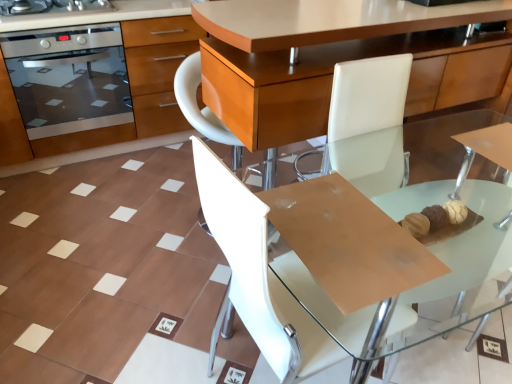
This screenshot has height=384, width=512. What do you see at coordinates (468, 247) in the screenshot?
I see `transparent glass table at center` at bounding box center [468, 247].

You are a GUI agent. You are given a task and a screenshot of the screen. Output one action in this format:
    pyautogui.click(x=<x>, y=<y>)
    Task: Click on the stainless steel oven at left
    This screenshot has width=512, height=384.
    Given the screenshot: What is the action you would take?
    pyautogui.click(x=68, y=78)

Locate an element on the screen. The height and width of the screenshot is (384, 512). stainless steel oven at left is located at coordinates (130, 86).

Based on the photo, in order to face white leather chair at center, should I rotate leftwards or rightwards?

Rotate right and turn 6.755 degrees.

I want to click on transparent glass table at center, so click(x=468, y=247).

Is stainless steel oven at left facing towards white leather chair at center?

Yes.

Would you say white leather chair at center is part of stainless steel oven at left's contents?

Actually, white leather chair at center is outside stainless steel oven at left.

Would you say stainless steel oven at left is to the left or to the right of white leather chair at center in the picture?

In the image, stainless steel oven at left appears on the left side of white leather chair at center.

Who is bigger, stainless steel oven at left or white leather chair at center?

With larger size is stainless steel oven at left.

Which of these two, transparent glass table at center or stainless steel oven at left, is smaller?

stainless steel oven at left is smaller.

Which point is more forward, (467, 251) or (99, 93)?

The point (467, 251) is closer to the camera.

From a real-world perspective, is transparent glass table at center physically below stainless steel oven at left?

Yes, from a real-world perspective, transparent glass table at center is beneath stainless steel oven at left.

Considering the positions of objects transparent glass table at center and stainless steel oven at left in the image provided, who is behind, transparent glass table at center or stainless steel oven at left?

stainless steel oven at left is further away from the camera.

From their relative heights in the image, would you say white leather chair at center is taller or shorter than stainless steel oven at upper left?

Considering their sizes, white leather chair at center has more height than stainless steel oven at upper left.

Between white leather chair at center and stainless steel oven at upper left, which one has smaller size?

stainless steel oven at upper left is smaller.

Considering the positions of objects white leather chair at center and stainless steel oven at upper left in the image provided, who is more to the right, white leather chair at center or stainless steel oven at upper left?

From the viewer's perspective, white leather chair at center appears more on the right side.

From the image's perspective, is white leather chair at center below stainless steel oven at upper left?

Yes, from the image's perspective, white leather chair at center is beneath stainless steel oven at upper left.

Considering their positions, is stainless steel oven at left located in front of or behind stainless steel oven at left?

Clearly, stainless steel oven at left is in front of stainless steel oven at left.

Is stainless steel oven at left bigger or smaller than stainless steel oven at left?

stainless steel oven at left is bigger than stainless steel oven at left.

Are stainless steel oven at left and stainless steel oven at left beside each other?

stainless steel oven at left and stainless steel oven at left are not in contact.

Does stainless steel oven at left have a lesser height compared to stainless steel oven at left?

No.

Does white leather chair at center have a larger size compared to stainless steel oven at left?

Actually, white leather chair at center might be smaller than stainless steel oven at left.

Based on the photo, which is farther from the camera, (223, 212) or (50, 141)?

Positioned behind is point (50, 141).

Between white leather chair at center and stainless steel oven at left, which one appears on the right side from the viewer's perspective?

Positioned to the right is white leather chair at center.

Is white leather chair at center positioned with its back to stainless steel oven at left?

white leather chair at center is not turned away from stainless steel oven at left.

Would you consider stainless steel oven at upper left to be distant from stainless steel oven at left?

No.

From a real-world perspective, is stainless steel oven at upper left above or below stainless steel oven at left?

stainless steel oven at upper left is above stainless steel oven at left.

Which object is further away from the camera, stainless steel oven at upper left or stainless steel oven at left?

stainless steel oven at left is more distant.

Is stainless steel oven at upper left inside the boundaries of stainless steel oven at left, or outside?

stainless steel oven at upper left cannot be found inside stainless steel oven at left.

Which of these two, transparent glass table at center or stainless steel oven at left, is smaller?

Smaller between the two is transparent glass table at center.

Would you say transparent glass table at center is inside or outside stainless steel oven at left?

transparent glass table at center cannot be found inside stainless steel oven at left.

Is transparent glass table at center beside stainless steel oven at left?

No, transparent glass table at center is not beside stainless steel oven at left.

In order to click on kitchen appliance that is on the left side of white leather chair at center in this screenshot , I will do `click(68, 78)`.

Locate an element on the screen. kitchen appliance lying behind the transparent glass table at center is located at coordinates (68, 78).

Looking at the image, which one is located closer to white leather chair at center, transparent glass table at center or stainless steel oven at left?

Among the two, transparent glass table at center is located nearer to white leather chair at center.

Which object lies further to the anchor point stainless steel oven at upper left, transparent glass table at center or white leather chair at center?

transparent glass table at center is positioned further to the anchor stainless steel oven at upper left.

Considering their positions, is stainless steel oven at left positioned closer to stainless steel oven at upper left than white leather chair at center?

stainless steel oven at left is closer to stainless steel oven at upper left.

When comparing their distances from stainless steel oven at upper left, does stainless steel oven at left or transparent glass table at center seem closer?

stainless steel oven at left.

Looking at the image, which one is located closer to stainless steel oven at left, stainless steel oven at upper left or white leather chair at center?

stainless steel oven at upper left is positioned closer to the anchor stainless steel oven at left.

From the image, which object appears to be nearer to stainless steel oven at left, transparent glass table at center or stainless steel oven at upper left?

The object closer to stainless steel oven at left is stainless steel oven at upper left.

Which object lies further to the anchor point stainless steel oven at upper left, stainless steel oven at left or white leather chair at center?

white leather chair at center.

Looking at the image, which one is located closer to white leather chair at center, stainless steel oven at upper left or stainless steel oven at left?

stainless steel oven at left lies closer to white leather chair at center than the other object.

Image resolution: width=512 pixels, height=384 pixels. I want to click on chair between stainless steel oven at left and transparent glass table at center in the horizontal direction, so click(x=259, y=275).

Where is `cabinetry located between stainless steel oven at left and transparent glass table at center in the left-right direction`? cabinetry located between stainless steel oven at left and transparent glass table at center in the left-right direction is located at coordinates (130, 86).

Identify the location of home appliance positioned between white leather chair at center and stainless steel oven at left from near to far. (50, 6).

In order to click on kitchen appliance between stainless steel oven at upper left and stainless steel oven at left vertically in this screenshot , I will do `click(68, 78)`.